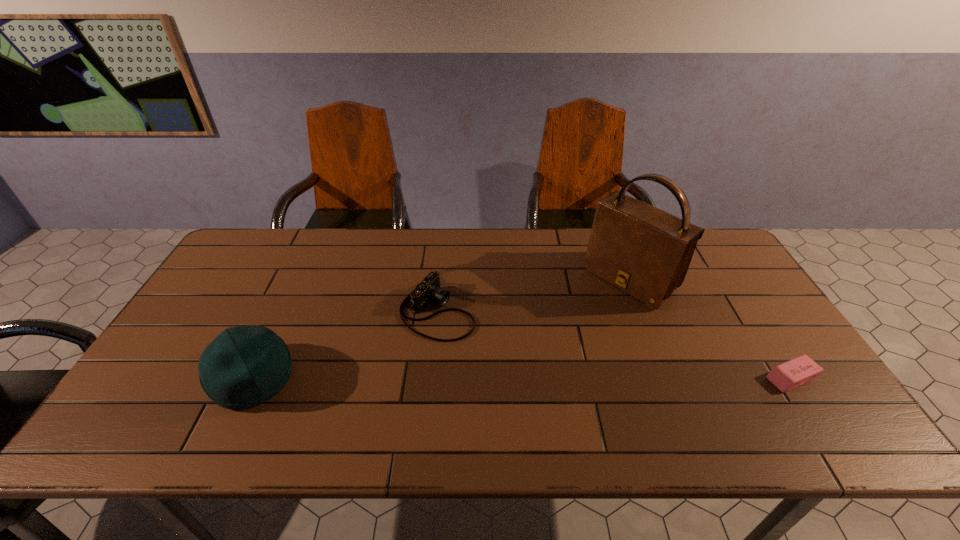
What are the coordinates of `vacant space located 0.110m on the front-facing side of the second object from left to right` in the screenshot? It's located at (505, 342).

Identify the location of vacant point located 0.110m on the front-facing side of the second object from left to right. This screenshot has width=960, height=540. (505, 342).

Image resolution: width=960 pixels, height=540 pixels. Find the location of `vacant area situated 0.210m on the front-facing side of the second object from left to right`. vacant area situated 0.210m on the front-facing side of the second object from left to right is located at coordinates (539, 357).

Locate an element on the screen. free space located 0.350m on the front flap of the tallest object is located at coordinates (523, 366).

Identify the location of free point located on the front flap of the tallest object. (552, 343).

This screenshot has height=540, width=960. What are the coordinates of `vacant space located on the front flap of the tallest object` in the screenshot? It's located at (529, 362).

Image resolution: width=960 pixels, height=540 pixels. Identify the location of object that is at the far edge. (644, 251).

Find the location of a particular element. The width and height of the screenshot is (960, 540). beanie present at the near edge is located at coordinates (245, 366).

At what (x,y) coordinates should I click in order to perform the action: click on eraser at the near edge. Please return your answer as a coordinate pair (x, y). This screenshot has height=540, width=960. Looking at the image, I should click on (794, 373).

Where is `object at the left edge`? object at the left edge is located at coordinates (245, 366).